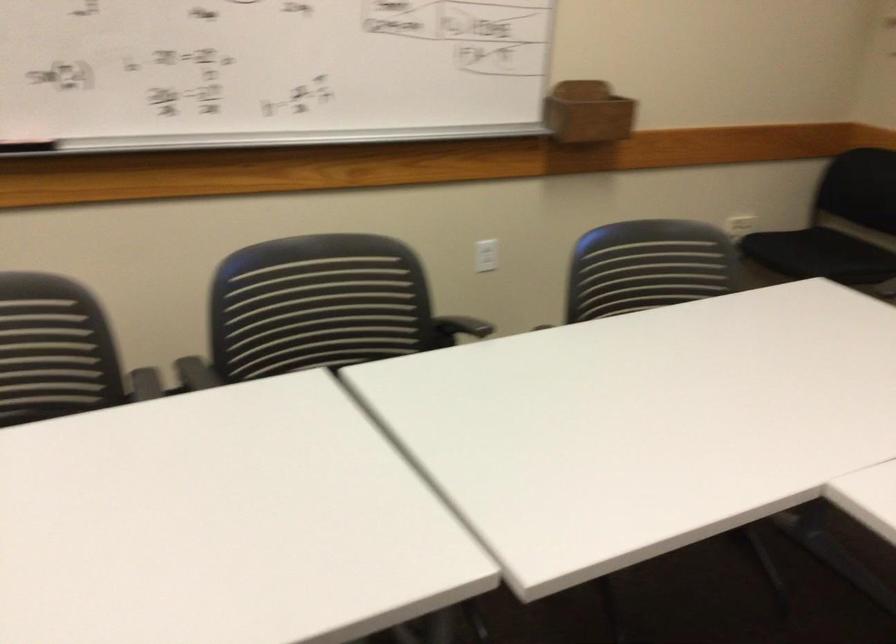
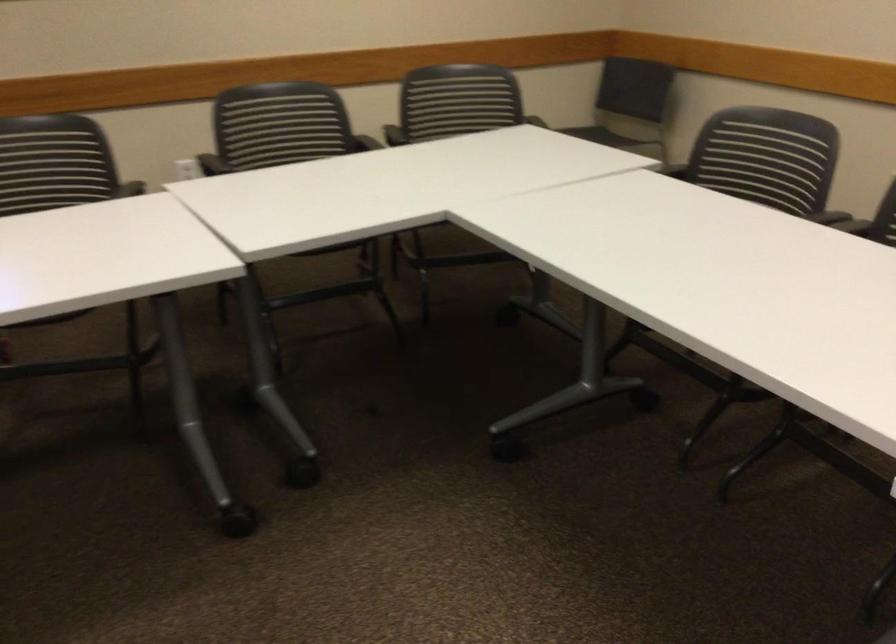
First-person continuous shooting, in which direction is the camera rotating?

The camera rotated toward right-down.